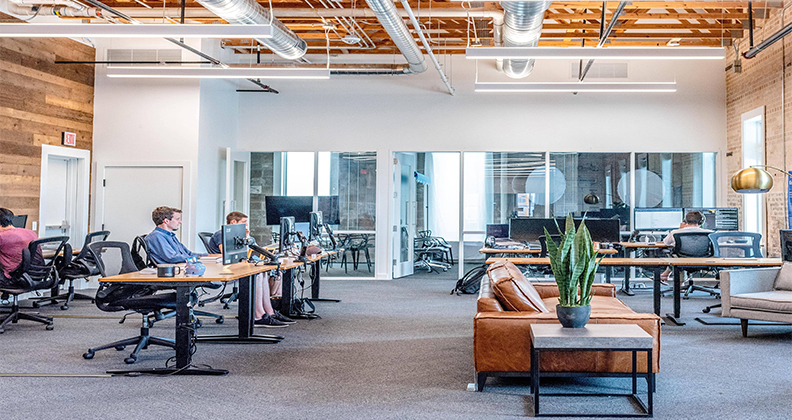
In order to click on plant in this screenshot , I will do `click(572, 284)`.